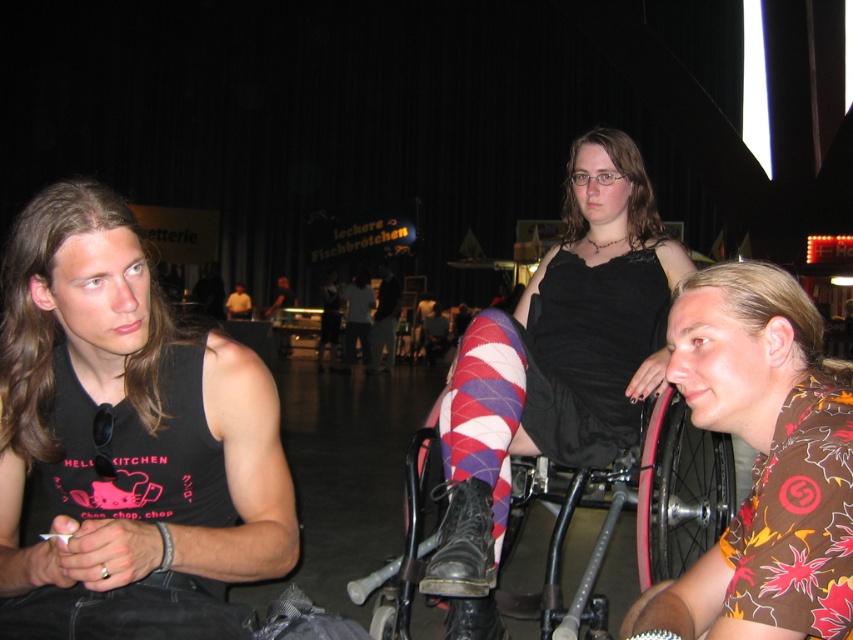
Looking at this image, who is more forward, (593, 172) or (474, 433)?

Point (474, 433) is in front.

Between argyle-patterned socks at center and argyle wool sock at center, which one appears on the right side from the viewer's perspective?

From the viewer's perspective, argyle-patterned socks at center appears more on the right side.

Does point (432, 582) come farther from viewer compared to point (483, 458)?

No, it is not.

Identify the location of argyle-patterned socks at center. (554, 365).

Which of these two, brown floral shirt at right or matte black tank top at left, stands shorter?

brown floral shirt at right

Between point (701, 346) and point (242, 316), which one is positioned in front?

Point (701, 346)

Where is `brown floral shirt at right`? The image size is (853, 640). brown floral shirt at right is located at coordinates (762, 461).

Can you confirm if matte black tank top at center is positioned above argyle-patterned socks at center?

Incorrect, matte black tank top at center is not positioned above argyle-patterned socks at center.

Who is positioned more to the left, matte black tank top at center or argyle-patterned socks at center?

From the viewer's perspective, matte black tank top at center appears more on the left side.

Which is in front, point (96, 596) or point (643, 205)?

Positioned in front is point (96, 596).

Find the location of a particular element. Image resolution: width=853 pixels, height=640 pixels. matte black tank top at center is located at coordinates (126, 435).